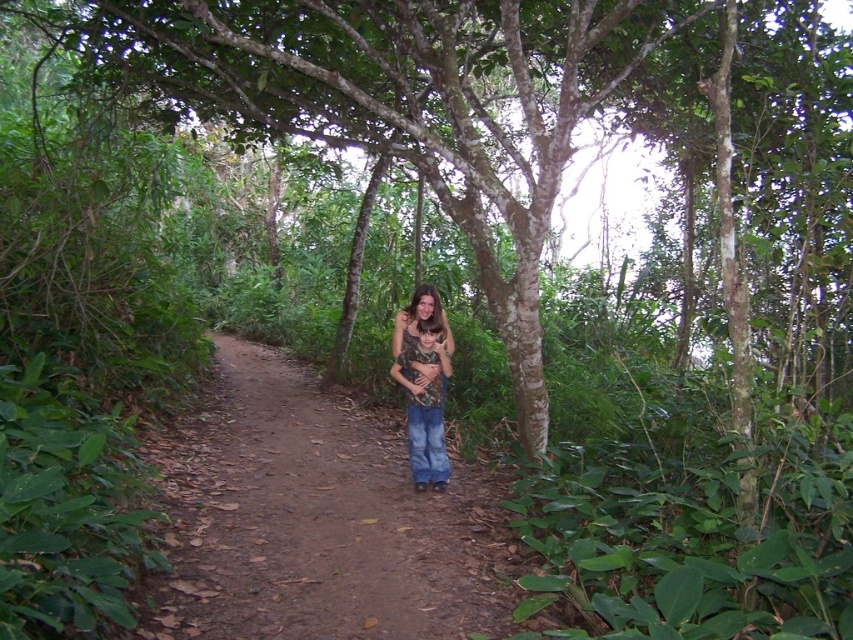
You are planning to walk along the brown dirt path at center while carrying a large backpack. Considering the width of the path and the presence of the camo fabric shirt at center, do you think you can comfortably walk through without needing to step off the path?

The brown dirt path at center is wider than the camo fabric shirt at center, so yes, you can comfortably walk through with a large backpack without needing to step off the path.

You are a hiker who wants to place a 3.5 feet long backpack on the ground between the brown dirt path at center and the camo fabric shirt at center. Is there enough space to place it without overlapping either object?

The brown dirt path at center is 4.17 feet away from the camo fabric shirt at center. Since the backpack is 3.5 feet long, there is enough space to place it between them without overlapping either object.

Based on the photo, you are hiking on a forest trail and see two points marked on the path. The first point is at coordinates point (428, 588) and the second is at point (418, 340). If you are facing the direction of the trail, which point is closer to you?

Point (428, 588) is in front of point (418, 340), so the point closer to you would be point (428, 588).